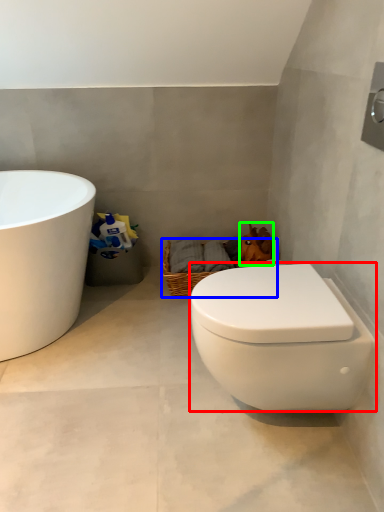
Question: Estimate the real-world distances between objects in this image. Which object is closer to toilet (highlighted by a red box), basket (highlighted by a blue box) or animal (highlighted by a green box)?

Choices:
 (A) basket
 (B) animal

Answer: (A)